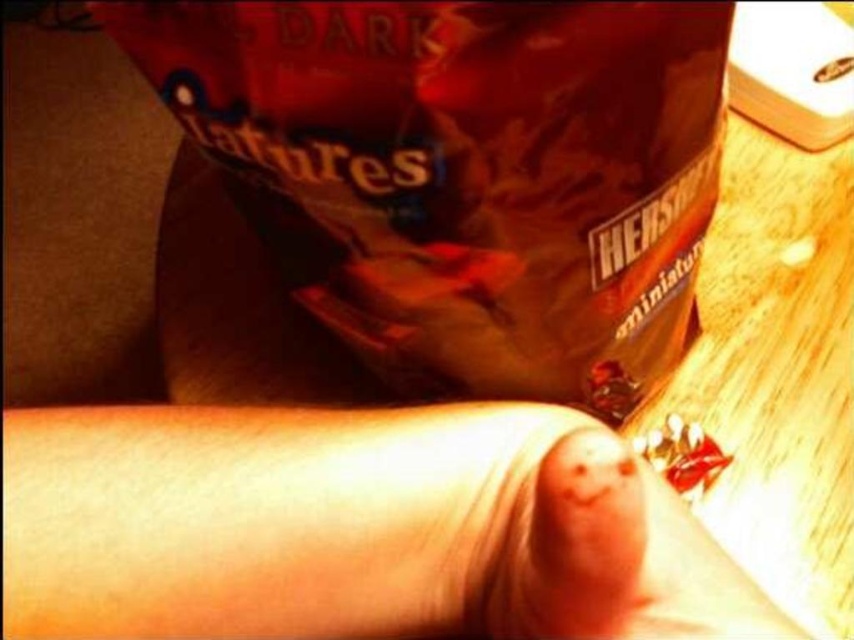
Is brown matte bag at upper center taller than smooth skin finger at lower center?

Yes.

Between point (525, 90) and point (357, 428), which one is positioned in front?

Positioned in front is point (525, 90).

The image size is (854, 640). What are the coordinates of `brown matte bag at upper center` in the screenshot? It's located at (464, 176).

The image size is (854, 640). In order to click on brown matte bag at upper center in this screenshot , I will do `click(464, 176)`.

Can you confirm if smooth skin finger at lower center is taller than smooth skin at center?

Yes.

Consider the image. Is smooth skin finger at lower center to the left of smooth skin at center from the viewer's perspective?

Indeed, smooth skin finger at lower center is positioned on the left side of smooth skin at center.

Which is in front, point (512, 516) or point (547, 497)?

Point (547, 497) is more forward.

Identify the location of smooth skin finger at lower center. (354, 528).

Who is shorter, brown matte bag at upper center or smooth skin at center?

With less height is smooth skin at center.

Where is `brown matte bag at upper center`? brown matte bag at upper center is located at coordinates (464, 176).

Is point (290, 259) positioned in front of point (575, 547)?

That is False.

Find the location of `brown matte bag at upper center`. brown matte bag at upper center is located at coordinates pyautogui.click(x=464, y=176).